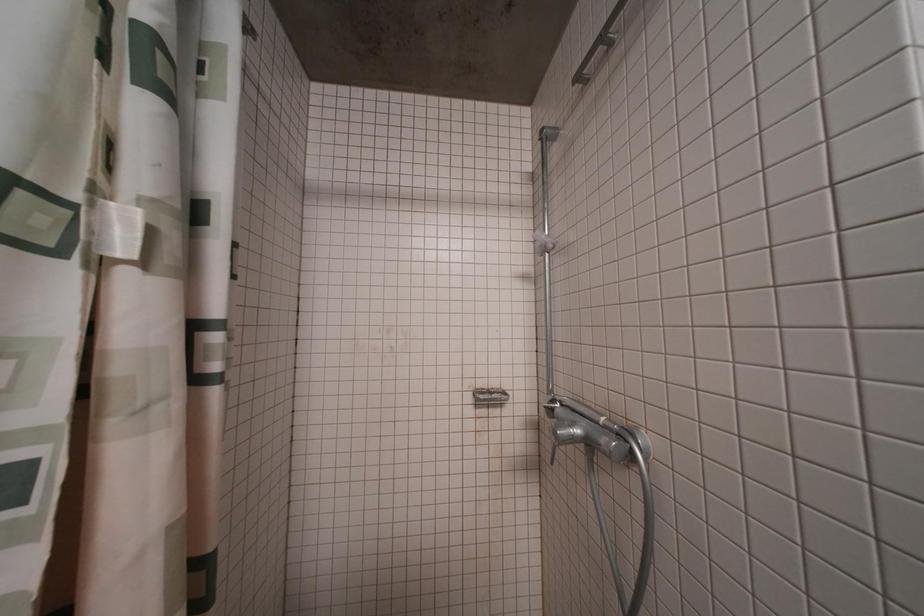
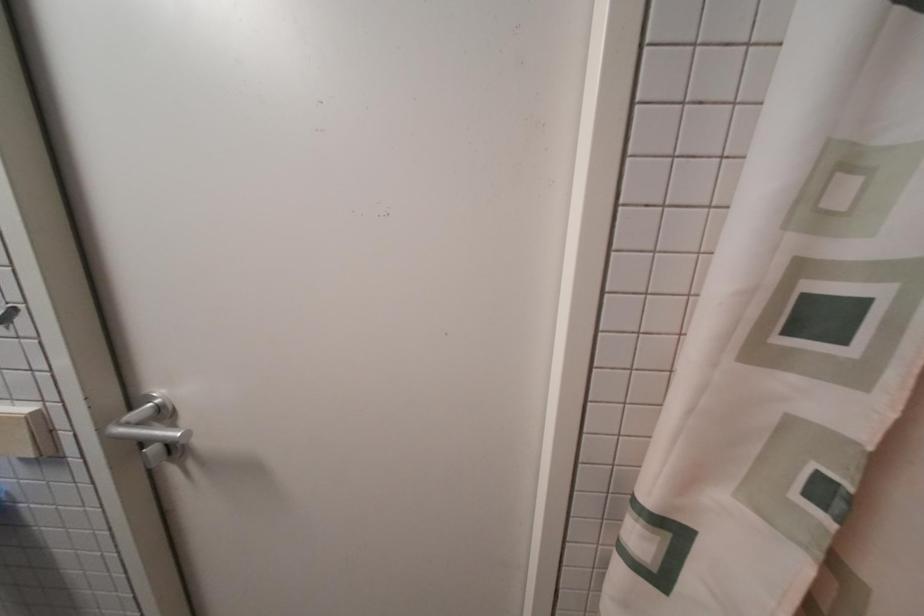
Question: The camera is either moving clockwise (left) or counter-clockwise (right) around the object. The first image is from the beginning of the video and the second image is from the end. Is the camera moving left or right when shooting the video?

Choices:
 (A) Left
 (B) Right

Answer: (B)